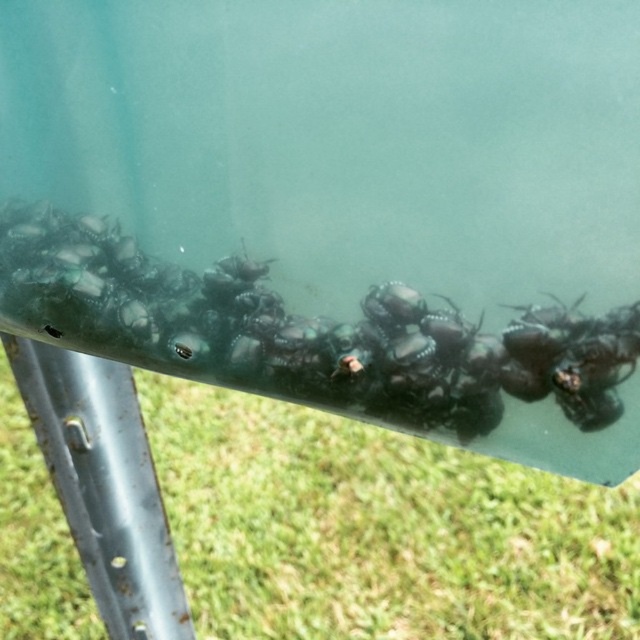
Does point (440, 452) lie behind point (236, 330)?

Yes, it is behind point (236, 330).

Does green grass at lower center have a lesser height compared to green glossy snails at center?

In fact, green grass at lower center may be taller than green glossy snails at center.

Between point (458, 563) and point (224, 316), which one is positioned in front?

Point (224, 316)

The height and width of the screenshot is (640, 640). Find the location of `green grass at lower center`. green grass at lower center is located at coordinates (378, 529).